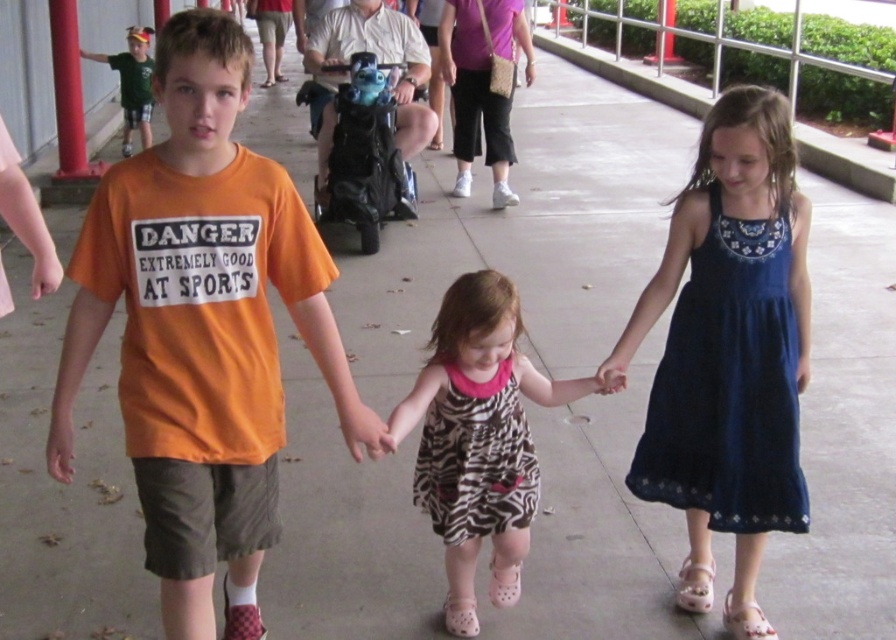
Question: Can you confirm if dark blue cotton dress at right is bigger than green jersey at upper left?

Choices:
 (A) yes
 (B) no

Answer: (B)

Question: Which of these objects is positioned closest to the orange cotton t-shirt at center?

Choices:
 (A) dark blue cotton dress at right
 (B) zebra print dress at center

Answer: (B)

Question: Which object is the closest to the zebra print fabric dress at center?

Choices:
 (A) green jersey at upper left
 (B) red painted metal pole at upper left

Answer: (B)

Question: Among these points, which one is farthest from the camera?

Choices:
 (A) (145, 262)
 (B) (461, 508)
 (C) (431, 428)

Answer: (C)

Question: In this image, where is orange cotton t-shirt at center located relative to green jersey at upper left?

Choices:
 (A) below
 (B) above

Answer: (A)

Question: Is zebra print fabric dress at center to the left of green jersey at upper left from the viewer's perspective?

Choices:
 (A) no
 (B) yes

Answer: (A)